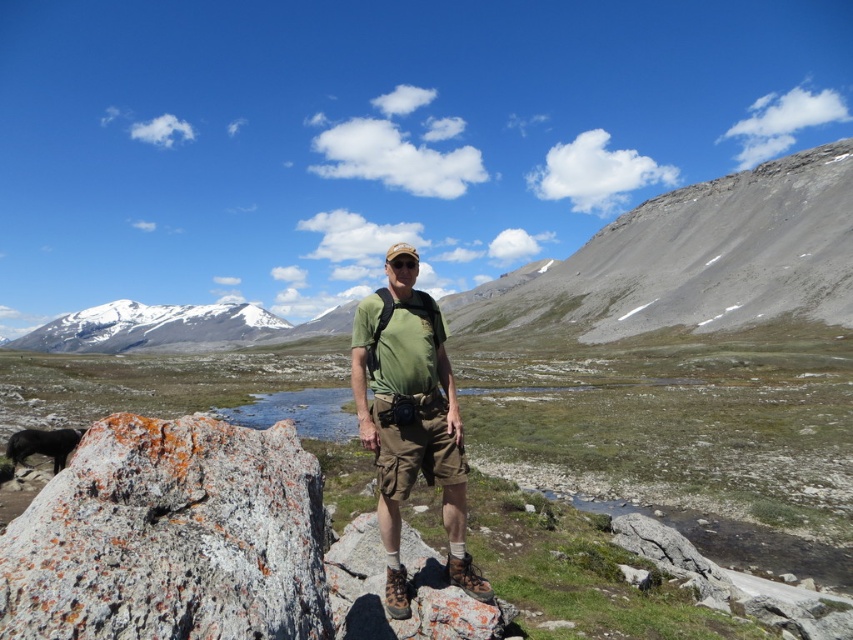
Based on the photo, is speckled gray rock at lower left positioned before snowy granite mountain at upper left?

Yes, speckled gray rock at lower left is closer to the viewer.

Is speckled gray rock at lower left to the right of snowy granite mountain at upper left from the viewer's perspective?

Yes, speckled gray rock at lower left is to the right of snowy granite mountain at upper left.

Who is more distant from viewer, (196, 541) or (112, 333)?

The point (112, 333) is behind.

This screenshot has height=640, width=853. I want to click on speckled gray rock at lower left, so coord(171,538).

Can you confirm if speckled gray rock at lower left is wider than green matte t-shirt at center?

No.

The width and height of the screenshot is (853, 640). What do you see at coordinates (171, 538) in the screenshot?
I see `speckled gray rock at lower left` at bounding box center [171, 538].

Between point (206, 476) and point (418, 376), which one is positioned in front?

Point (206, 476)

At what (x,y) coordinates should I click in order to perform the action: click on speckled gray rock at lower left. Please return your answer as a coordinate pair (x, y). The width and height of the screenshot is (853, 640). Looking at the image, I should click on (171, 538).

Locate an element on the screen. Image resolution: width=853 pixels, height=640 pixels. green matte t-shirt at center is located at coordinates (410, 419).

Is green matte t-shirt at center wider than snowy granite mountain at upper left?

No.

The width and height of the screenshot is (853, 640). What do you see at coordinates (410, 419) in the screenshot?
I see `green matte t-shirt at center` at bounding box center [410, 419].

This screenshot has height=640, width=853. I want to click on green matte t-shirt at center, so click(x=410, y=419).